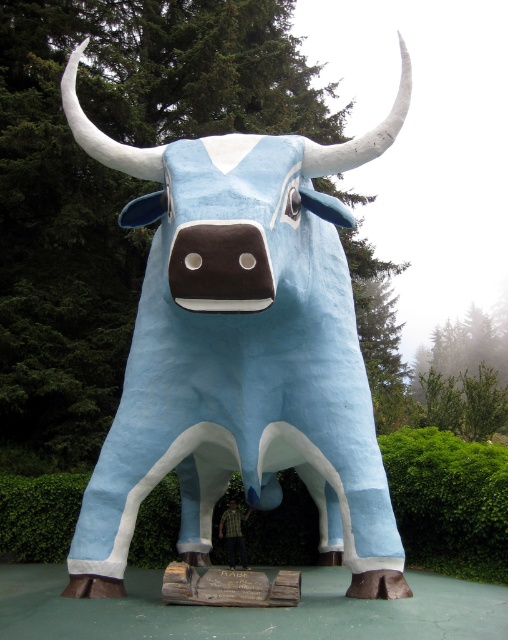
You are a photographer wanting to capture the light blue matte bull at center and the green leafy hedge at lower center in a single frame. Considering their heights, which object should you focus on first to ensure both are in the frame?

The light blue matte bull at center is taller than the green leafy hedge at lower center, so you should focus on the light blue matte bull at center first to ensure both are in the frame.

Consider the image. You are a landscape architect designing a garden pathway. You need to place a bench between the light blue matte bull at center and the green leafy hedge at lower center. Which object should the bench be closer to if you want it to be equidistant from both?

The bench should be closer to the green leafy hedge at lower center because the light blue matte bull at center might be wider than the green leafy hedge at lower center, so placing it closer to the hedge would help balance the distance.

What are the coordinates of the light blue matte bull at center?

The light blue matte bull at center is located at point [241,349].